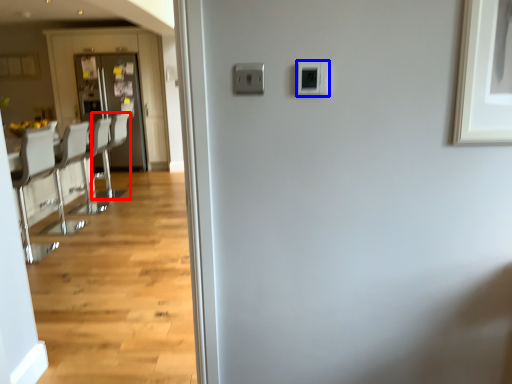
Question: Which of the following is the farthest to the observer, armchair (highlighted by a red box) or light switch (highlighted by a blue box)?

Choices:
 (A) armchair
 (B) light switch

Answer: (A)